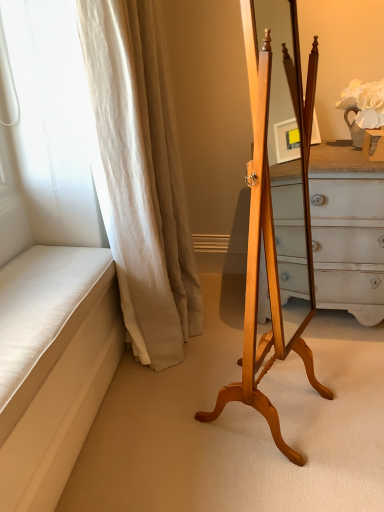
Question: Is white fabric curtain at left positioned behind light wood easel at center?

Choices:
 (A) no
 (B) yes

Answer: (B)

Question: Is white fabric curtain at left to the left of light wood easel at center from the viewer's perspective?

Choices:
 (A) no
 (B) yes

Answer: (B)

Question: Is white fabric curtain at left far from light wood easel at center?

Choices:
 (A) no
 (B) yes

Answer: (A)

Question: Would you say white fabric curtain at left is outside light wood easel at center?

Choices:
 (A) no
 (B) yes

Answer: (B)

Question: Can you confirm if white fabric curtain at left is wider than light wood easel at center?

Choices:
 (A) no
 (B) yes

Answer: (B)

Question: Is light wood easel at center inside white fabric curtain at left?

Choices:
 (A) no
 (B) yes

Answer: (A)

Question: Would you say light wood easel at center is outside white fabric curtain at left?

Choices:
 (A) no
 (B) yes

Answer: (B)

Question: Is light wood easel at center further to the viewer compared to white fabric curtain at left?

Choices:
 (A) yes
 (B) no

Answer: (B)

Question: Is there a large distance between light wood easel at center and white fabric curtain at left?

Choices:
 (A) no
 (B) yes

Answer: (A)

Question: From a real-world perspective, is light wood easel at center physically below white fabric curtain at left?

Choices:
 (A) no
 (B) yes

Answer: (B)

Question: From the image's perspective, is light wood easel at center on top of white fabric curtain at left?

Choices:
 (A) no
 (B) yes

Answer: (A)

Question: Does light wood easel at center have a lesser width compared to white fabric curtain at left?

Choices:
 (A) yes
 (B) no

Answer: (A)

Question: Would you say light wood easel at center is to the left or to the right of white fabric curtain at left in the picture?

Choices:
 (A) right
 (B) left

Answer: (A)